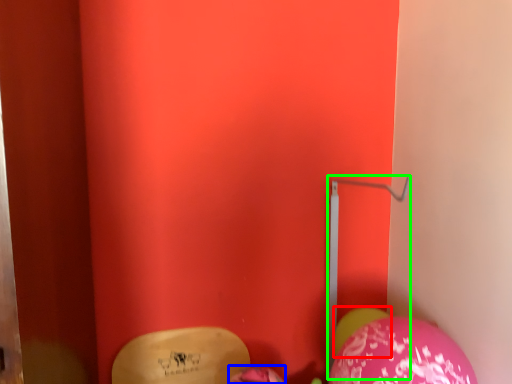
Question: Based on their relative distances, which object is farther from balloon (highlighted by a red box)? Choose from balloon (highlighted by a blue box) and trim (highlighted by a green box).

Choices:
 (A) balloon
 (B) trim

Answer: (A)